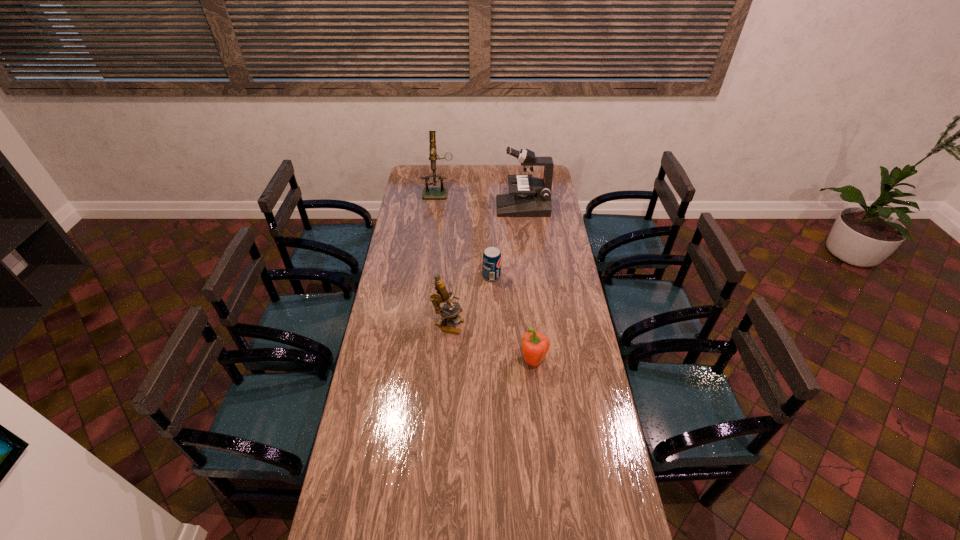
Locate an element on the screen. This screenshot has width=960, height=540. free region located on the left of the nearest microscope is located at coordinates (391, 325).

Where is `vacant space located on the right of the pepper`? vacant space located on the right of the pepper is located at coordinates (570, 362).

The height and width of the screenshot is (540, 960). Find the location of `free space located on the left of the third nearest object`. free space located on the left of the third nearest object is located at coordinates (407, 276).

At what (x,y) coordinates should I click in order to perform the action: click on object at the far edge. Please return your answer as a coordinate pair (x, y). Looking at the image, I should click on (441, 192).

Where is `object that is at the left edge`? Image resolution: width=960 pixels, height=540 pixels. object that is at the left edge is located at coordinates (441, 192).

This screenshot has width=960, height=540. I want to click on object located in the right edge section of the desktop, so click(532, 196).

This screenshot has height=540, width=960. I want to click on object present at the far left corner, so click(x=441, y=192).

At what (x,y) coordinates should I click in order to perform the action: click on vacant space at the far edge of the desktop. Please return your answer as a coordinate pair (x, y). This screenshot has width=960, height=540. Looking at the image, I should click on (496, 178).

Where is `vacant space at the left edge of the desktop`? Image resolution: width=960 pixels, height=540 pixels. vacant space at the left edge of the desktop is located at coordinates (381, 343).

The width and height of the screenshot is (960, 540). In the image, there is a desktop. Identify the location of vacant region at the right edge. (543, 301).